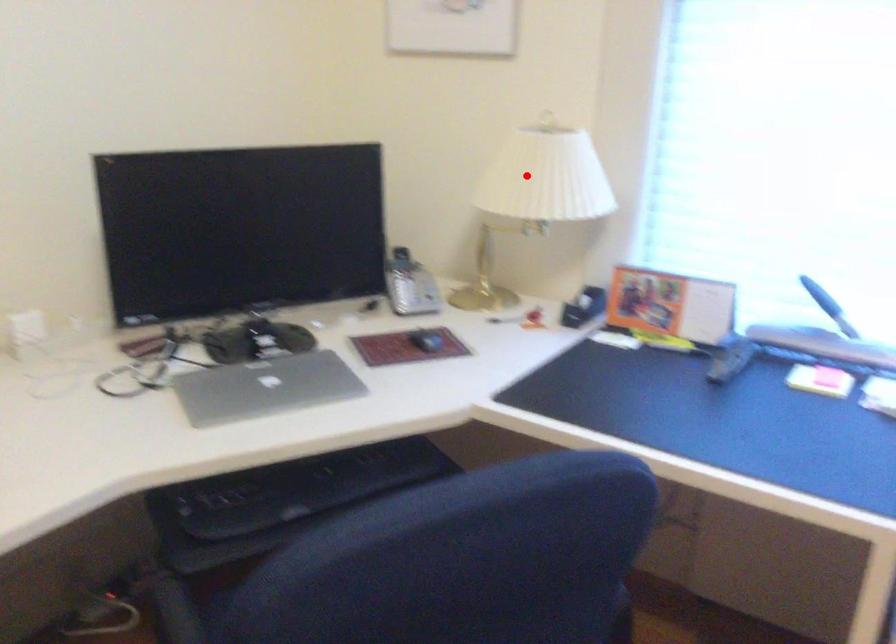
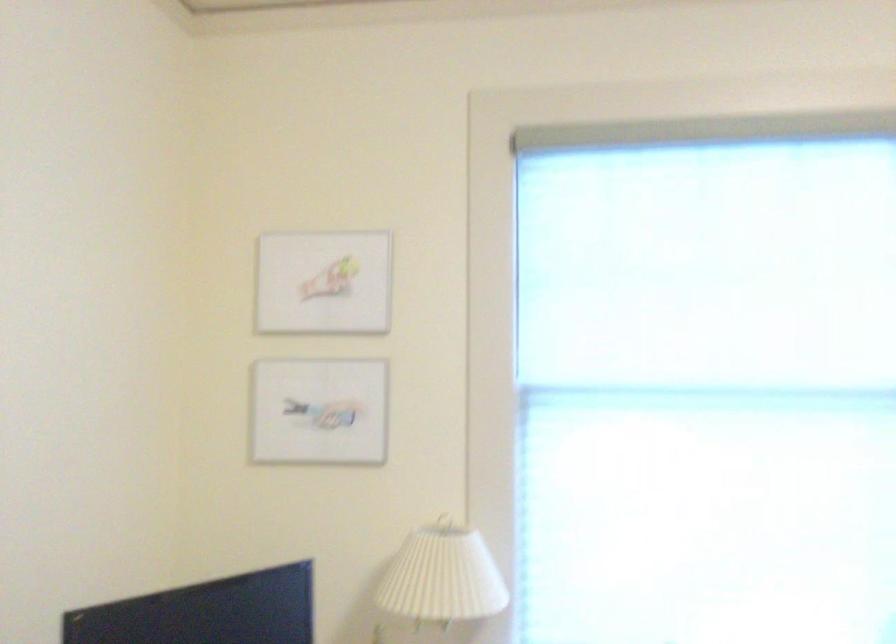
Find the pixel in the second image that matches the highlighted location in the first image.

(443, 576)